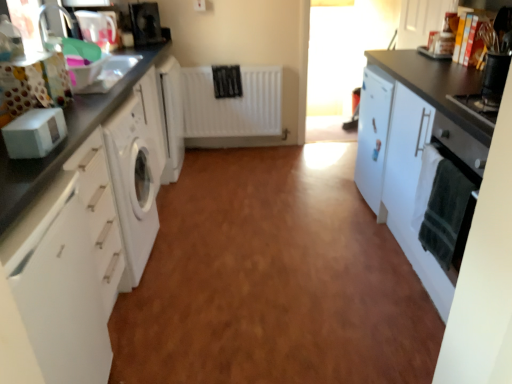
Question: Considering the relative sizes of white matte cabinet at left, the 2th cabinetry from the right, and white matte radiator at center in the image provided, is white matte cabinet at left, the 2th cabinetry from the right, wider than white matte radiator at center?

Choices:
 (A) no
 (B) yes

Answer: (B)

Question: From the image's perspective, does white matte cabinet at left, arranged as the second cabinetry when viewed from the left, appear lower than white matte radiator at center?

Choices:
 (A) yes
 (B) no

Answer: (A)

Question: From a real-world perspective, is white matte cabinet at left, the 2th cabinetry from the right, physically above white matte radiator at center?

Choices:
 (A) no
 (B) yes

Answer: (B)

Question: Does white matte cabinet at left, arranged as the second cabinetry when viewed from the left, appear on the right side of white matte radiator at center?

Choices:
 (A) no
 (B) yes

Answer: (A)

Question: Would you say white matte cabinet at left, the 2th cabinetry from the right, contains white matte radiator at center?

Choices:
 (A) no
 (B) yes

Answer: (A)

Question: In terms of height, does white glossy washing machine at left look taller or shorter compared to black plastic container at upper right, acting as the third appliance starting from the back?

Choices:
 (A) short
 (B) tall

Answer: (A)

Question: Looking at their shapes, would you say white glossy washing machine at left is wider or thinner than black plastic container at upper right, the 3th appliance from the top?

Choices:
 (A) thin
 (B) wide

Answer: (B)

Question: Is white glossy washing machine at left situated inside black plastic container at upper right, which appears as the 4th appliance when viewed from the left, or outside?

Choices:
 (A) outside
 (B) inside

Answer: (A)

Question: Is point [x=349, y=206] positioned closer to the camera than point [x=500, y=82]?

Choices:
 (A) closer
 (B) farther

Answer: (B)

Question: Choose the correct answer: Is white glossy washing machine at left inside white glossy jug at upper left, which is the 4th appliance in right-to-left order, or outside it?

Choices:
 (A) inside
 (B) outside

Answer: (B)

Question: Considering the positions of white glossy washing machine at left and white glossy jug at upper left, which is the 4th appliance in right-to-left order, in the image, is white glossy washing machine at left wider or thinner than white glossy jug at upper left, which is the 4th appliance in right-to-left order,?

Choices:
 (A) thin
 (B) wide

Answer: (B)

Question: Visually, is white glossy washing machine at left positioned to the left or to the right of white glossy jug at upper left, which is the 3th appliance from front to back?

Choices:
 (A) left
 (B) right

Answer: (B)

Question: Is white glossy washing machine at left bigger or smaller than white glossy jug at upper left, the second appliance in the back-to-front sequence?

Choices:
 (A) big
 (B) small

Answer: (A)

Question: Is white glossy jug at upper left, which appears as the 2th appliance when viewed from the top, bigger or smaller than white matte cabinet at right, which ranks as the first cabinetry in right-to-left order?

Choices:
 (A) small
 (B) big

Answer: (A)

Question: From the image's perspective, relative to white matte cabinet at right, which ranks as the first cabinetry in right-to-left order, is white glossy jug at upper left, which is the 4th appliance in right-to-left order, above or below?

Choices:
 (A) above
 (B) below

Answer: (A)